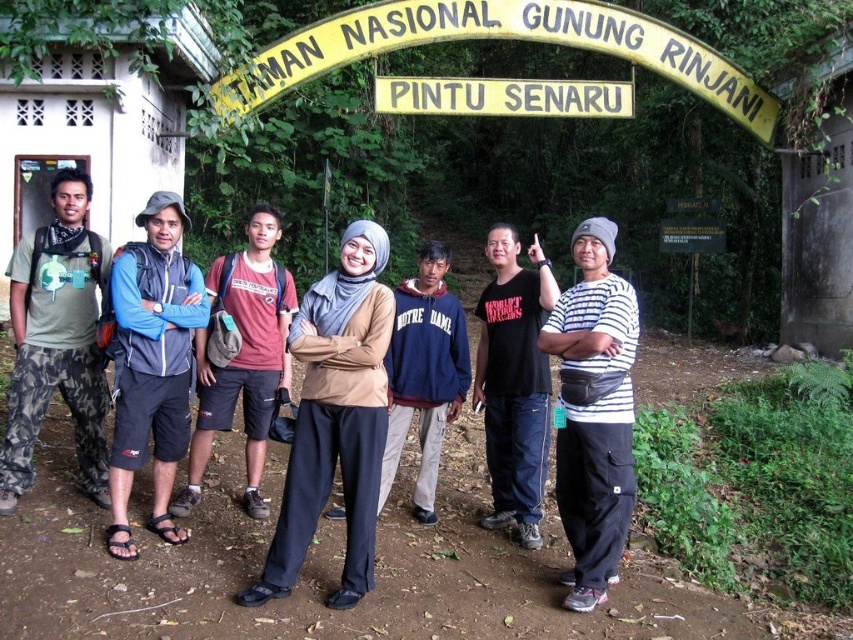
Question: Based on their relative distances, which object is farther from the blue fabric jacket at left?

Choices:
 (A) yellow painted wood sign at upper center
 (B) black matte shirt at center
 (C) beige fabric hijab at center
 (D) camouflage fabric pants at left

Answer: (A)

Question: In this image, where is striped cotton shirt at center located relative to yellowmaterial/texturesign at center?

Choices:
 (A) below
 (B) above

Answer: (A)

Question: Among these points, which one is nearest to the camera?

Choices:
 (A) (570, 532)
 (B) (631, 88)

Answer: (A)

Question: Does striped cotton shirt at center have a larger size compared to blue fabric jacket at center?

Choices:
 (A) no
 (B) yes

Answer: (B)

Question: Which point is farther to the camera?

Choices:
 (A) (436, 291)
 (B) (519, 321)
 (C) (4, 476)
 (D) (180, 276)

Answer: (A)

Question: Does yellow painted wood sign at upper center appear under yellowmaterial/texturesign at center?

Choices:
 (A) yes
 (B) no

Answer: (B)